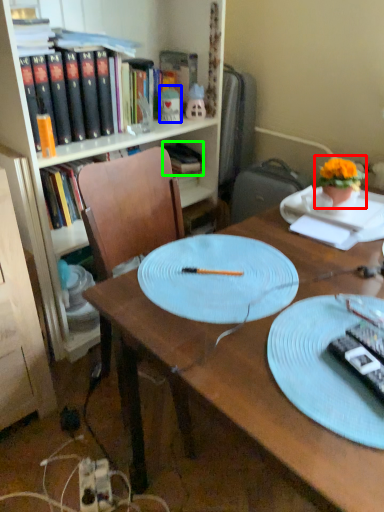
Question: Estimate the real-world distances between objects in this image. Which object is farther from houseplant (highlighted by a red box), toy (highlighted by a blue box) or book (highlighted by a green box)?

Choices:
 (A) toy
 (B) book

Answer: (B)